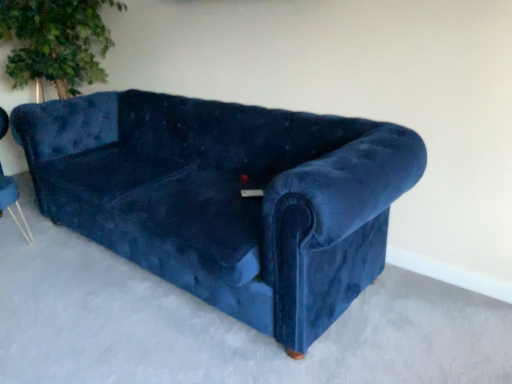
Measure the distance between point (199, 196) and camera.

Point (199, 196) and camera are 5.73 feet apart from each other.

What do you see at coordinates (226, 197) in the screenshot? I see `velvet blue couch at center` at bounding box center [226, 197].

The image size is (512, 384). Find the location of `velvet blue couch at center`. velvet blue couch at center is located at coordinates (226, 197).

Find the location of `velvet blue couch at center`. velvet blue couch at center is located at coordinates (226, 197).